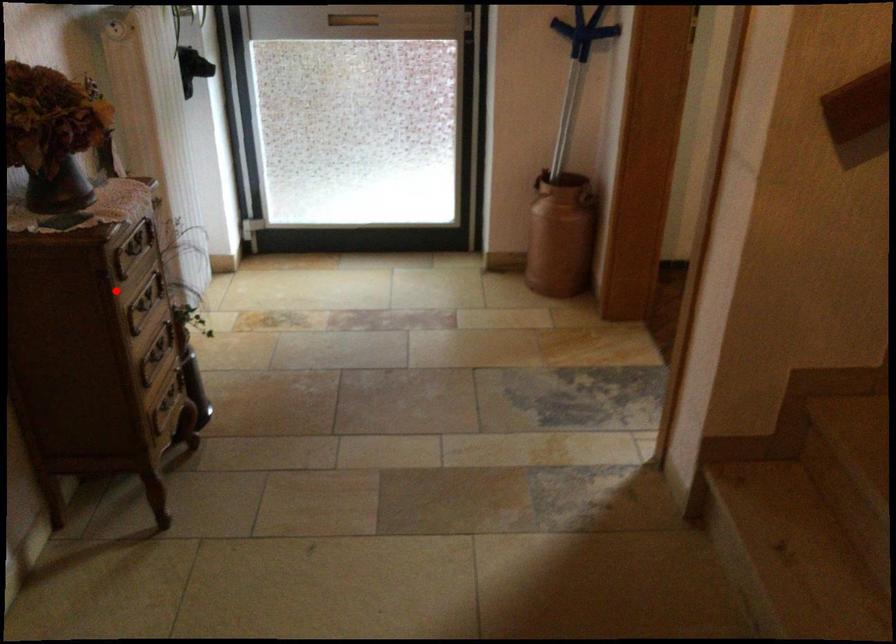
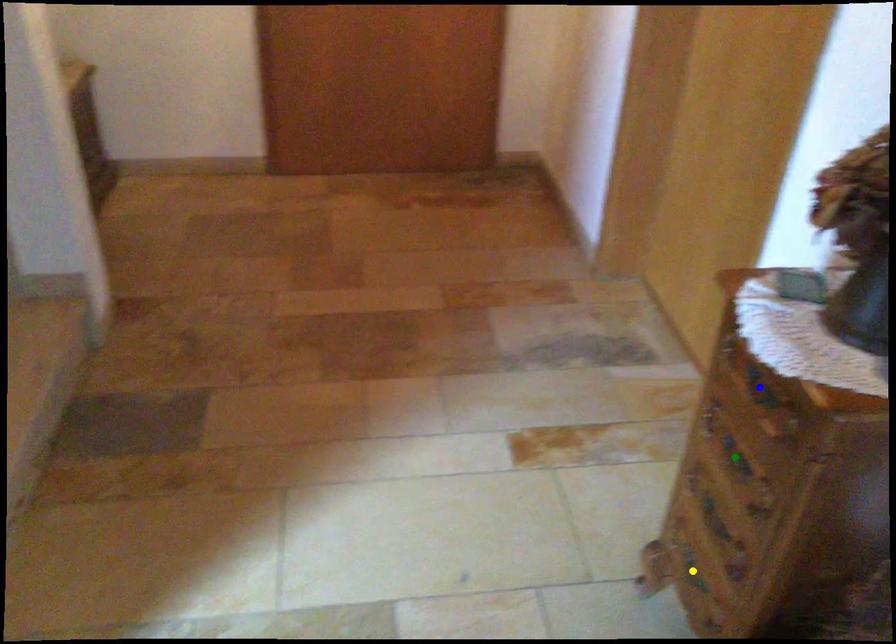
Question: I am providing you with two images of the same scene from different viewpoints. A red point is marked on the first image. You are given multiple points on the second image. Which mark in image 2 goes with the point in image 1?

Choices:
 (A) blue point
 (B) yellow point
 (C) green point

Answer: (A)